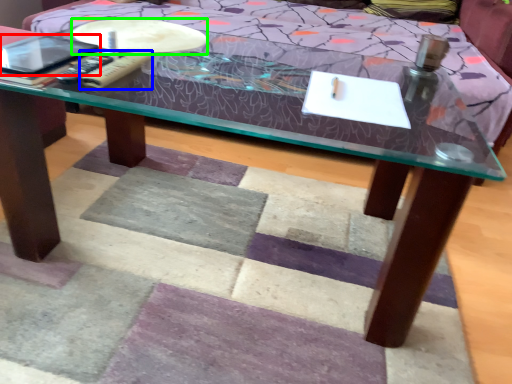
Question: Based on their relative distances, which object is nearer to tablet computer (highlighted by a red box)? Choose from remote (highlighted by a blue box) and round table (highlighted by a green box).

Choices:
 (A) remote
 (B) round table

Answer: (A)